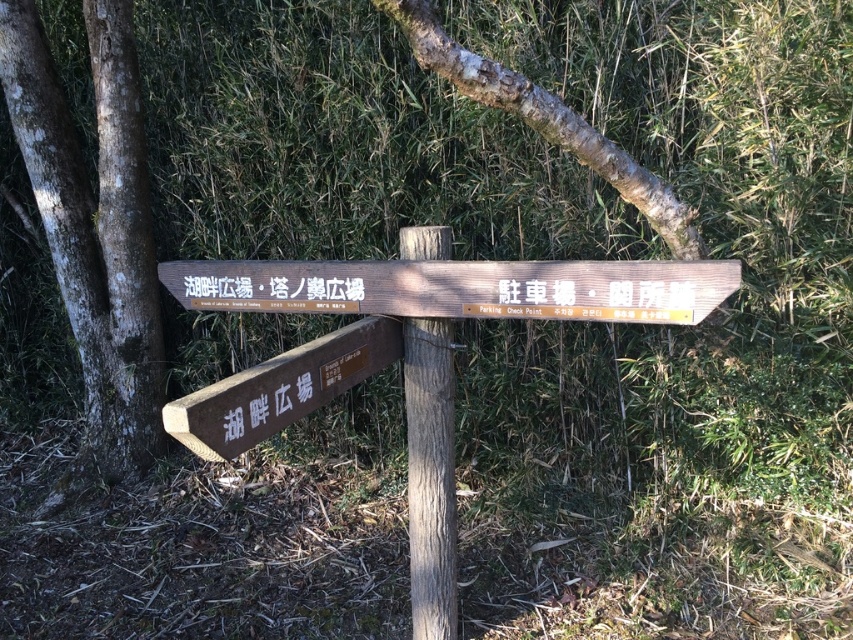
You are a hiker carrying a backpack and need to read both the wooden sign at center and the wooden signpost at center. Since you have limited time, can you quickly glance at both without moving your head? Explain why or why not based on their distance apart.

The wooden sign at center and the wooden signpost at center are 19.48 inches apart from each other. Since 19.48 inches is approximately 1.62 feet, which is a short distance, you can quickly glance at both without moving your head as they are close enough to be within your field of view.

You are standing in front of the wooden directional signpost. There is a specific point marked at coordinates point [111,284]. If you want to touch this point with a stick that is 4 meters long, will the stick be long enough?

The distance of point [111,284] from the camera is 4.13 meters. Since the stick is only 4 meters long, it is shorter than the required distance. Therefore, the stick will not be long enough to reach the point.

You are a hiker trying to read the signs at the wooden sign at center and the brown wooden sign at lower left. Which one is placed higher up?

The wooden sign at center is positioned over the brown wooden sign at lower left, so it is placed higher up.